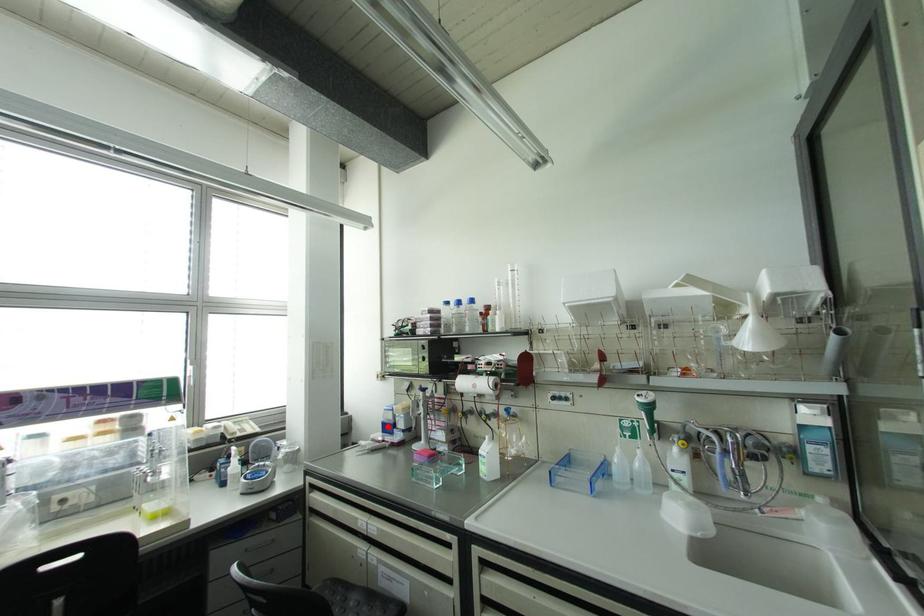
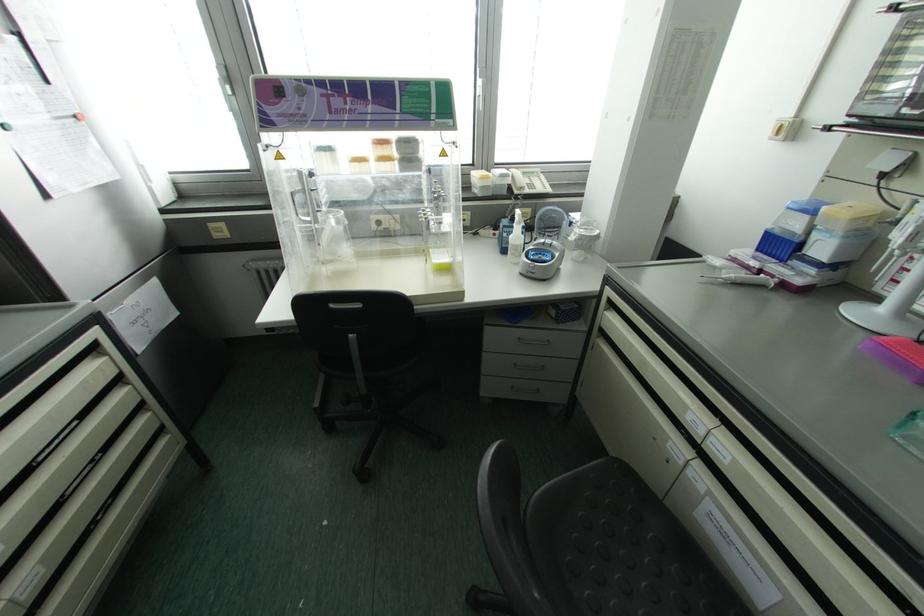
Question: I am providing you with two images of the same scene from different viewpoints. In image1, a red point is highlighted. Considering the same 3D point in image2, which of the following is correct?

Choices:
 (A) It is closer
 (B) It is farther

Answer: (A)